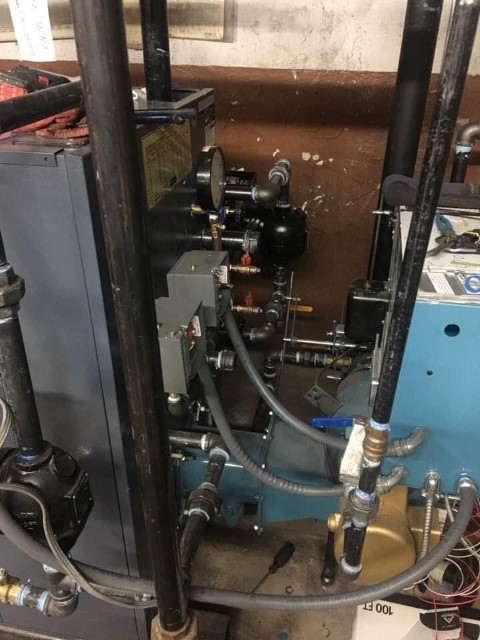
The image size is (480, 640). I want to click on boiler room, so click(127, 412).